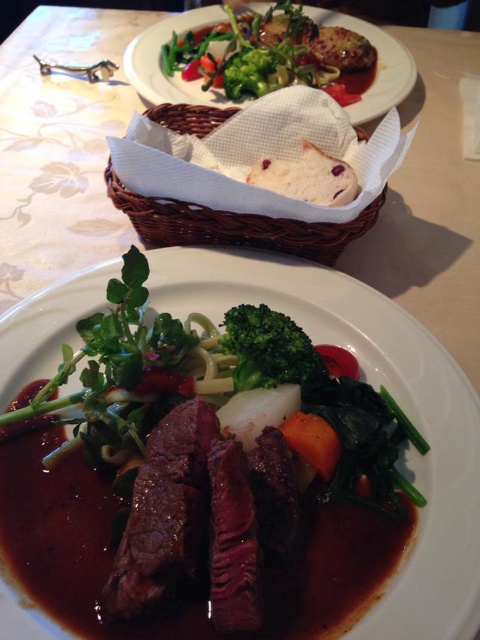
You are a food critic standing 60 cm away from the table where the savory brown steak at center is placed. Can you reach the steak without moving your position?

The distance between the savory brown steak at center and the viewer is 63.83 centimeters. Since you are standing 60 cm away from the table, you are 3.83 centimeters too far to reach the steak without moving.

Looking at the meal on the white plate, which object among the savory brown steak at center and the green matte broccoli at center takes up more space?

The savory brown steak at center is larger in size than the green matte broccoli at center, so it takes up more space.

You are a food critic evaluating this meal. You notice a point at coordinates [374,387] on the plate. What type of food item is located at that point?

The point at coordinates [374,387] corresponds to the savory brown steak at center.